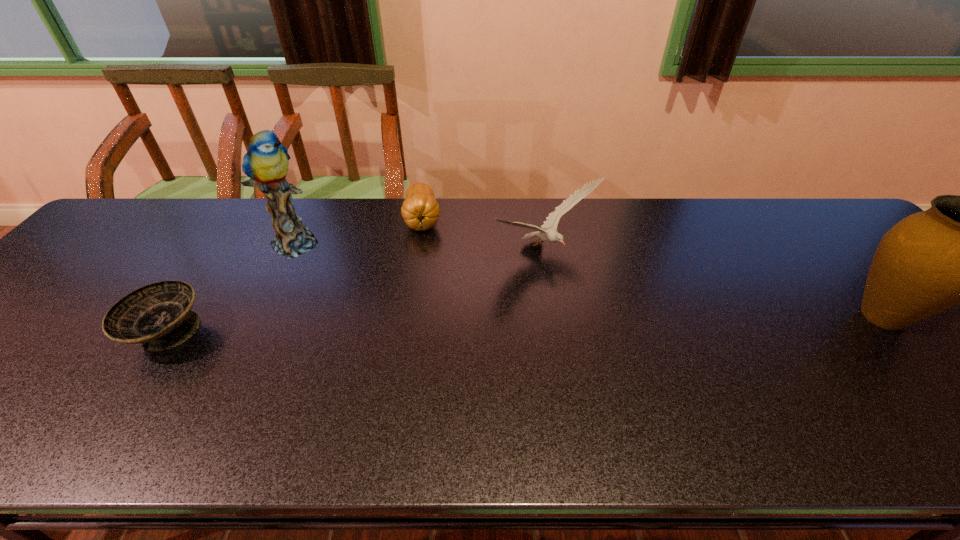
At what (x,y) coordinates should I click in order to perform the action: click on vacant space located 0.220m at the tip of the beak of the fourth object from left to right. Please return your answer as a coordinate pair (x, y). This screenshot has width=960, height=540. Looking at the image, I should click on (645, 327).

Find the location of a particular element. The image size is (960, 540). gourd positioned at the far edge is located at coordinates (420, 210).

Find the location of `parrot present at the far edge`. parrot present at the far edge is located at coordinates (266, 163).

The width and height of the screenshot is (960, 540). I want to click on gull situated at the far edge, so click(551, 234).

Identify the location of object located in the right edge section of the desktop. Image resolution: width=960 pixels, height=540 pixels. (959, 251).

In the image, there is a desktop. Where is `vacant space at the far edge`? The image size is (960, 540). vacant space at the far edge is located at coordinates (201, 202).

Locate an element on the screen. The image size is (960, 540). vacant space at the near edge is located at coordinates (786, 404).

This screenshot has width=960, height=540. In the image, there is a desktop. In order to click on free region at the left edge in this screenshot , I will do `click(22, 338)`.

The height and width of the screenshot is (540, 960). Find the location of `free space at the right edge`. free space at the right edge is located at coordinates (819, 249).

The image size is (960, 540). Identify the location of vacant area at the far left corner of the desktop. (144, 233).